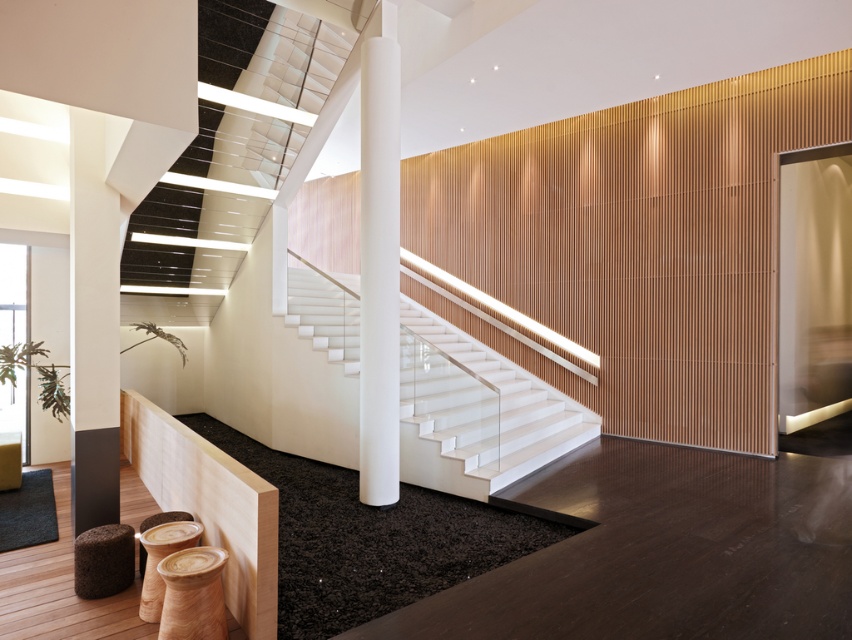
Question: Which point is farther to the camera?

Choices:
 (A) (114, 192)
 (B) (424, 403)
 (C) (163, 532)
 (D) (390, 262)

Answer: (B)

Question: Does brown fuzzy stool at lower left appear over wooden textured stool at lower left?

Choices:
 (A) yes
 (B) no

Answer: (B)

Question: Which of the following is the farthest from the observer?

Choices:
 (A) (173, 515)
 (B) (220, 513)

Answer: (A)

Question: Does brown fuzzy stool at lower left have a larger size compared to wooden stool at lower left?

Choices:
 (A) no
 (B) yes

Answer: (A)

Question: Which point appears farthest from the camera in this image?

Choices:
 (A) (369, 192)
 (B) (160, 516)
 (C) (258, 497)
 (D) (85, 140)

Answer: (A)

Question: Does white glossy column at left appear on the left side of natural wood balustrade at lower left?

Choices:
 (A) no
 (B) yes

Answer: (A)